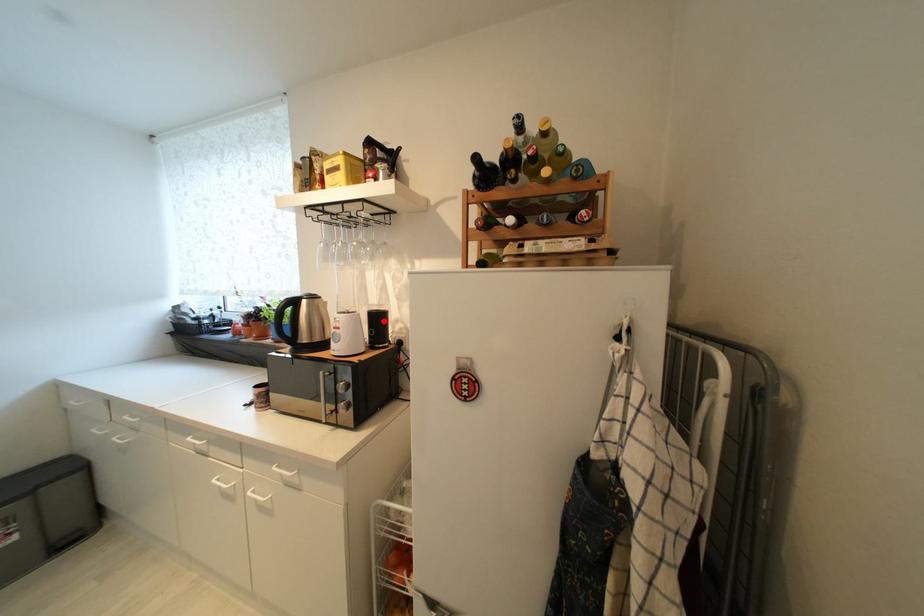
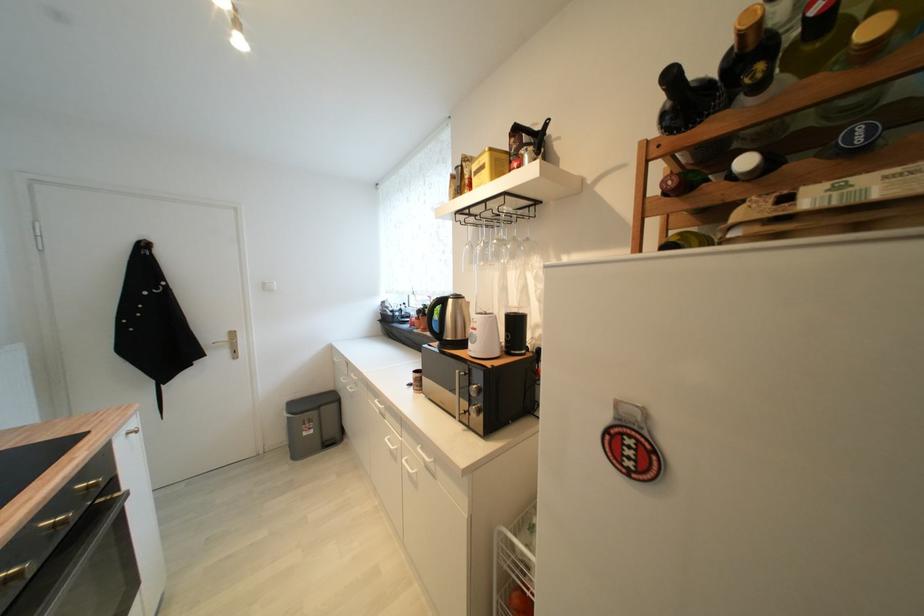
Find the pixel in the second image that matches the highlighted location in the first image.

(521, 325)